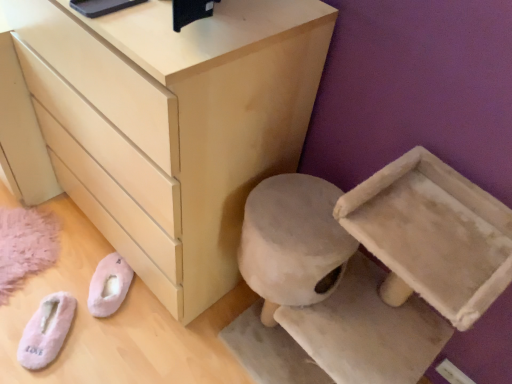
Question: Is point (100, 274) positioned closer to the camera than point (196, 31)?

Choices:
 (A) farther
 (B) closer

Answer: (A)

Question: Considering the positions of pink fuzzy slippers at lower left, the 1th footwear from the right, and matte light wood chest of drawers at center in the image, is pink fuzzy slippers at lower left, the 1th footwear from the right, taller or shorter than matte light wood chest of drawers at center?

Choices:
 (A) tall
 (B) short

Answer: (B)

Question: Based on their relative distances, which object is nearer to the matte light wood chest of drawers at center?

Choices:
 (A) pink fluffy slippers at lower left, which ranks as the first footwear in left-to-right order
 (B) pink fuzzy slippers at lower left, the second footwear when ordered from left to right

Answer: (B)

Question: Which object is positioned farthest from the pink fluffy slippers at lower left, which is counted as the second footwear, starting from the right?

Choices:
 (A) pink fuzzy slippers at lower left, the second footwear when ordered from left to right
 (B) matte light wood chest of drawers at center

Answer: (B)